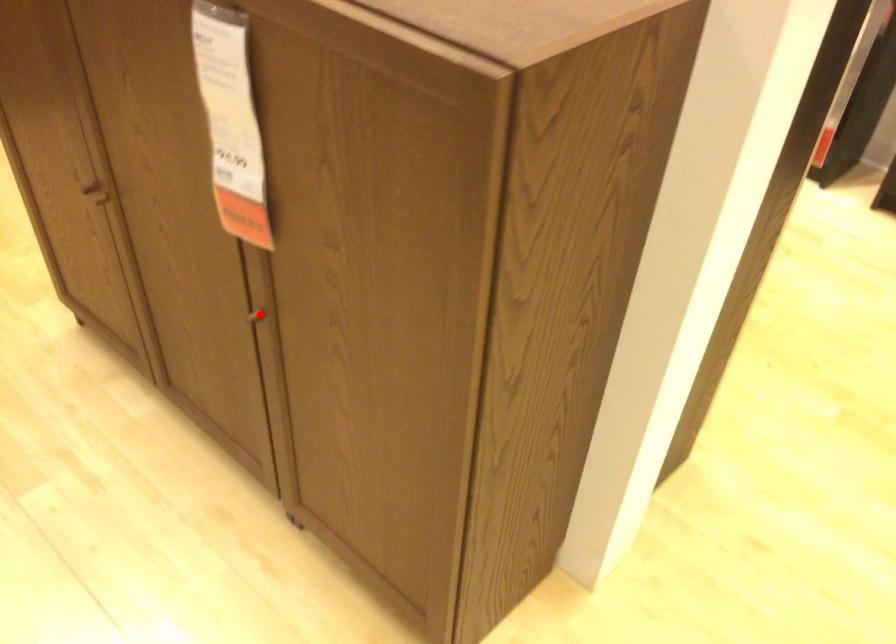
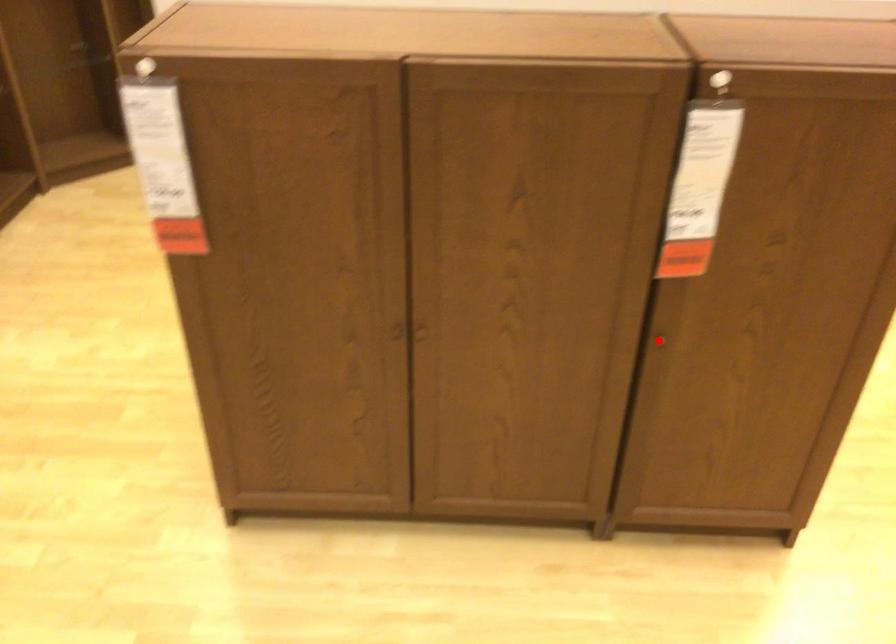
I am providing you with two images of the same scene from different viewpoints. A red point is marked on the first image and another point is marked on the second image. Is the marked point in image1 the same physical position as the marked point in image2?

Yes